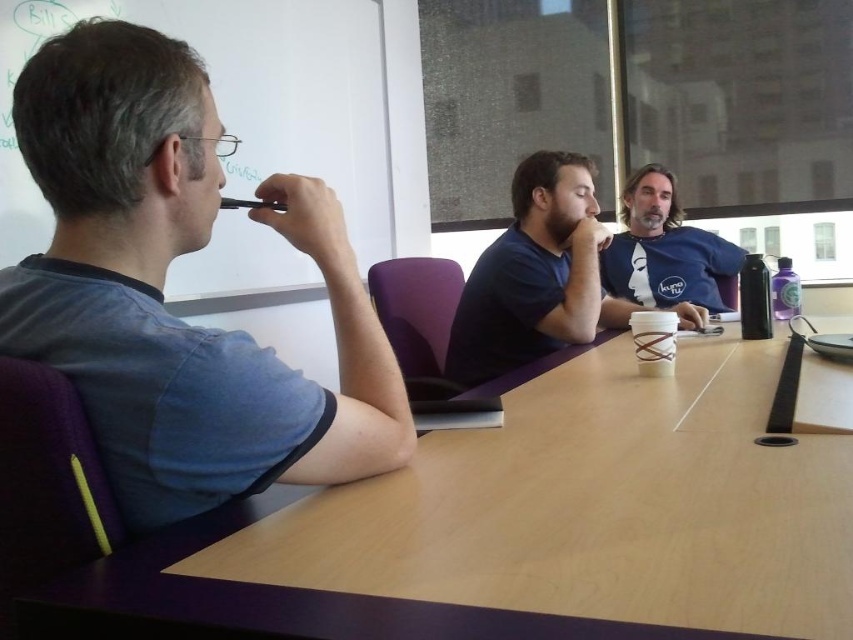
Between blue cotton shirt at left and blue cotton shirt at upper center, which one is positioned higher?

blue cotton shirt at upper center is above.

From the picture: Is blue cotton shirt at left to the left of blue cotton shirt at upper center from the viewer's perspective?

Yes, blue cotton shirt at left is to the left of blue cotton shirt at upper center.

Who is more forward, (175, 408) or (631, 180)?

Point (175, 408)

Where is `blue cotton shirt at left`? blue cotton shirt at left is located at coordinates (163, 285).

Who is lower down, light brown wood table at center or blue cotton shirt at left?

light brown wood table at center is lower down.

Between light brown wood table at center and blue cotton shirt at left, which one has more height?

Standing taller between the two is blue cotton shirt at left.

Identify the location of light brown wood table at center. (521, 529).

Locate an element on the screen. light brown wood table at center is located at coordinates coord(521,529).

Who is positioned more to the left, blue cotton shirt at left or matte blue shirt at center?

From the viewer's perspective, blue cotton shirt at left appears more on the left side.

Is point (144, 236) positioned in front of point (525, 280)?

Yes, point (144, 236) is in front of point (525, 280).

Does point (68, 160) come in front of point (587, 205)?

Yes, it is in front of point (587, 205).

This screenshot has width=853, height=640. I want to click on blue cotton shirt at left, so click(163, 285).